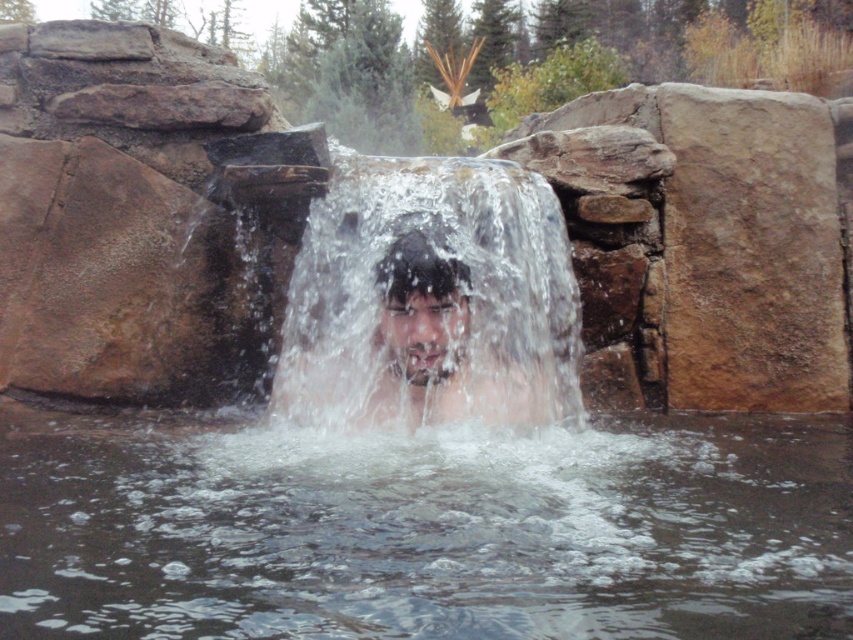
Question: Estimate the real-world distances between objects in this image. Which object is closer to the clear liquid water at center?

Choices:
 (A) smooth skin face at center
 (B) clear water at center

Answer: (A)

Question: Does clear water at center come behind smooth skin face at center?

Choices:
 (A) yes
 (B) no

Answer: (A)

Question: Which is farther from the smooth skin face at center?

Choices:
 (A) clear water at center
 (B) clear liquid water at center

Answer: (B)

Question: Which point is farther to the camera?

Choices:
 (A) clear liquid water at center
 (B) smooth skin face at center

Answer: (B)

Question: From the image, what is the correct spatial relationship of clear water at center in relation to smooth skin face at center?

Choices:
 (A) left
 (B) right

Answer: (A)

Question: Does clear water at center appear over smooth skin face at center?

Choices:
 (A) no
 (B) yes

Answer: (B)